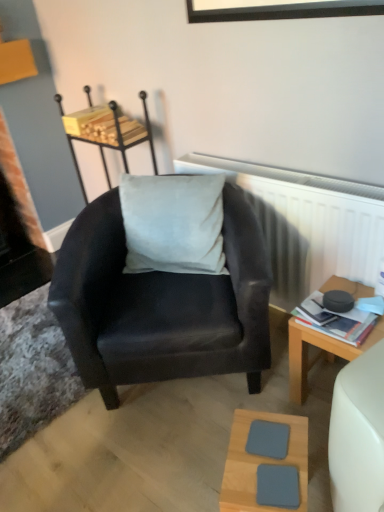
Question: Is suede black armchair at center completely or partially outside of wooden desk at right?

Choices:
 (A) yes
 (B) no

Answer: (A)

Question: Does suede black armchair at center have a lesser width compared to wooden desk at right?

Choices:
 (A) yes
 (B) no

Answer: (B)

Question: Is suede black armchair at center far away from wooden desk at right?

Choices:
 (A) no
 (B) yes

Answer: (A)

Question: From a real-world perspective, is suede black armchair at center on wooden desk at right?

Choices:
 (A) yes
 (B) no

Answer: (A)

Question: Is wooden desk at right a part of suede black armchair at center?

Choices:
 (A) yes
 (B) no

Answer: (B)

Question: Considering their positions, is light wood/texture square coaster at lower center located in front of or behind wooden desk at right?

Choices:
 (A) front
 (B) behind

Answer: (A)

Question: Do you think light wood/texture square coaster at lower center is within wooden desk at right, or outside of it?

Choices:
 (A) outside
 (B) inside

Answer: (A)

Question: Considering the positions of light wood/texture square coaster at lower center and wooden desk at right in the image, is light wood/texture square coaster at lower center wider or thinner than wooden desk at right?

Choices:
 (A) wide
 (B) thin

Answer: (B)

Question: In terms of height, does light wood/texture square coaster at lower center look taller or shorter compared to wooden desk at right?

Choices:
 (A) tall
 (B) short

Answer: (B)

Question: Is light gray fabric stool at center taller or shorter than wooden desk at right?

Choices:
 (A) tall
 (B) short

Answer: (A)

Question: Considering their positions, is light gray fabric stool at center located in front of or behind wooden desk at right?

Choices:
 (A) front
 (B) behind

Answer: (B)

Question: From a real-world perspective, is light gray fabric stool at center physically located above or below wooden desk at right?

Choices:
 (A) above
 (B) below

Answer: (A)

Question: In terms of size, does light gray fabric stool at center appear bigger or smaller than wooden desk at right?

Choices:
 (A) small
 (B) big

Answer: (B)

Question: Is light gray fabric stool at center in front of or behind hardcover book at right in the image?

Choices:
 (A) behind
 (B) front

Answer: (A)

Question: Is point (127, 120) positioned closer to the camera than point (317, 306)?

Choices:
 (A) closer
 (B) farther

Answer: (B)